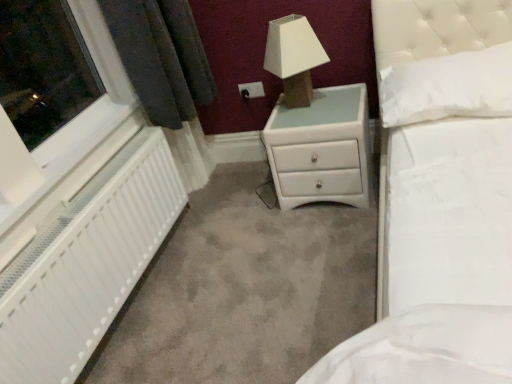
Question: Is white fabric lampshade at upper center in front of or behind white textured radiator at left in the image?

Choices:
 (A) behind
 (B) front

Answer: (A)

Question: From a real-world perspective, is white fabric lampshade at upper center above or below white textured radiator at left?

Choices:
 (A) above
 (B) below

Answer: (A)

Question: Considering the real-world distances, which object is closest to the white fabric lampshade at upper center?

Choices:
 (A) white soft pillow at upper right
 (B) white textured radiator at left
 (C) white plastic window at left
 (D) white plastic electric outlet at upper center
 (E) white glossy chest of drawers at center

Answer: (E)

Question: Based on their relative distances, which object is nearer to the white plastic electric outlet at upper center?

Choices:
 (A) white fabric lampshade at upper center
 (B) white plastic window at left
 (C) white glossy chest of drawers at center
 (D) white soft pillow at upper right
 (E) white textured radiator at left

Answer: (A)